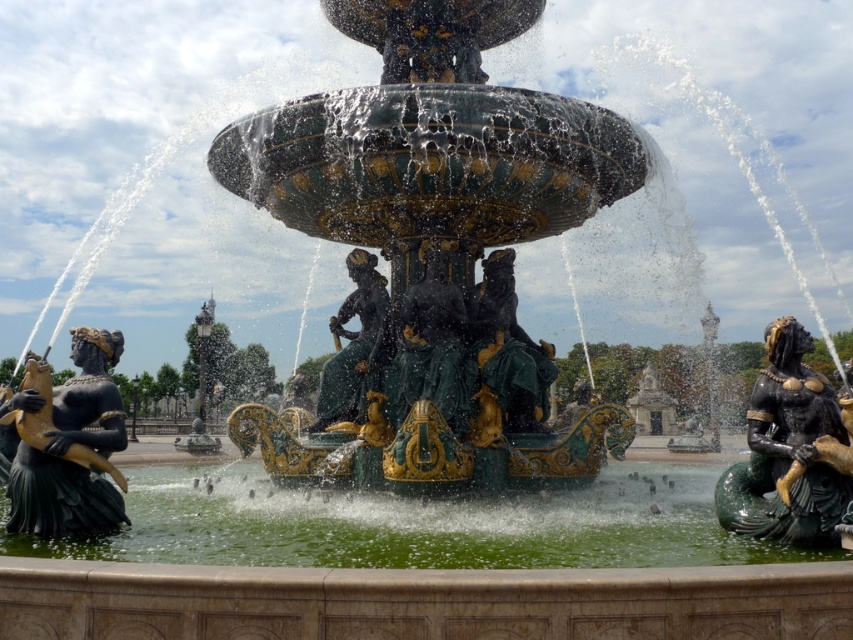
You are a tour guide explaining the fountain to visitors. You want to highlight the statues in the scene. Which of the two statues, the black polished statue at left or the black polished mermaid at right, is bigger?

The black polished statue at left is larger in size compared to the black polished mermaid at right.

You are designing a new pathway around the fountain and need to know the relative sizes of the statues to ensure proper spacing. Which object is wider, the black polished mermaid at right or the green patina statue at center?

The black polished mermaid at right is wider than the green patina statue at center according to the description.